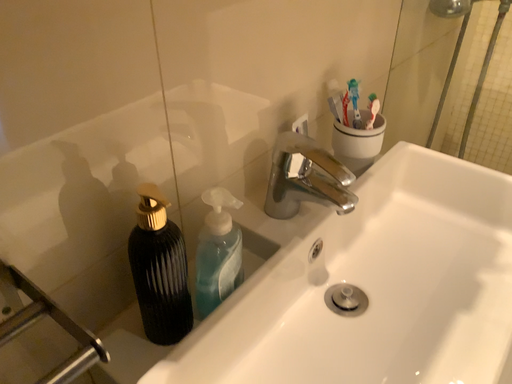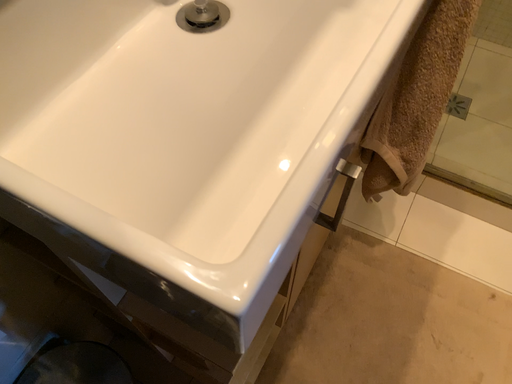
Question: Which way did the camera rotate in the video?

Choices:
 (A) rotated left
 (B) rotated right

Answer: (B)